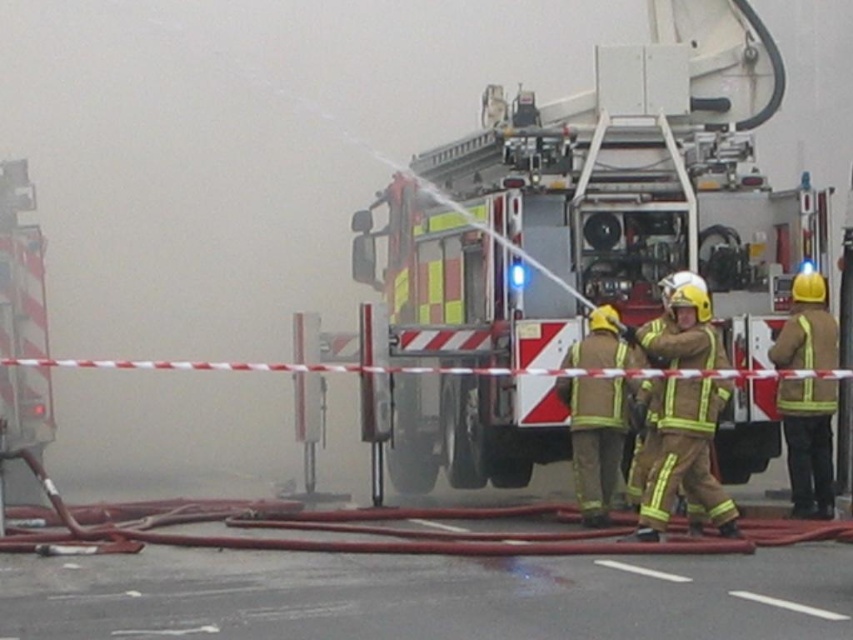
You are a firefighter observing two colleagues in the scene. You notice that one is wearing a yellow reflective uniform at center and another is wearing a yellow reflective uniform at right. Which colleague is closer to the ground?

The yellow reflective uniform at center is shorter than the yellow reflective uniform at right, so the colleague in the yellow reflective uniform at center is closer to the ground.

You are a firefighter standing at point [589,353]. You need to reach point [798,420] to retrieve a hose. Is the point you need to reach in front of or behind you?

The point [798,420] is behind point [589,353], so the point you need to reach is behind you.

Looking at this image, you are a firefighter trying to locate your yellow reflective uniform at right. You are currently standing next to the reflective silver fire truck at center. Which direction should you move to find your uniform?

The reflective silver fire truck at center is positioned on the right side of yellow reflective uniform at right, so to find your uniform, you should move to your left from the fire truck.